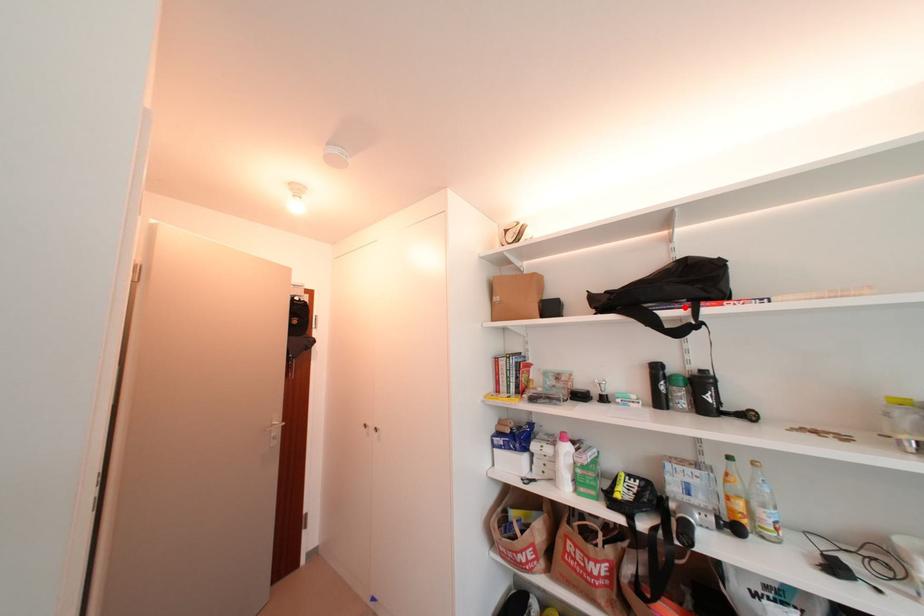
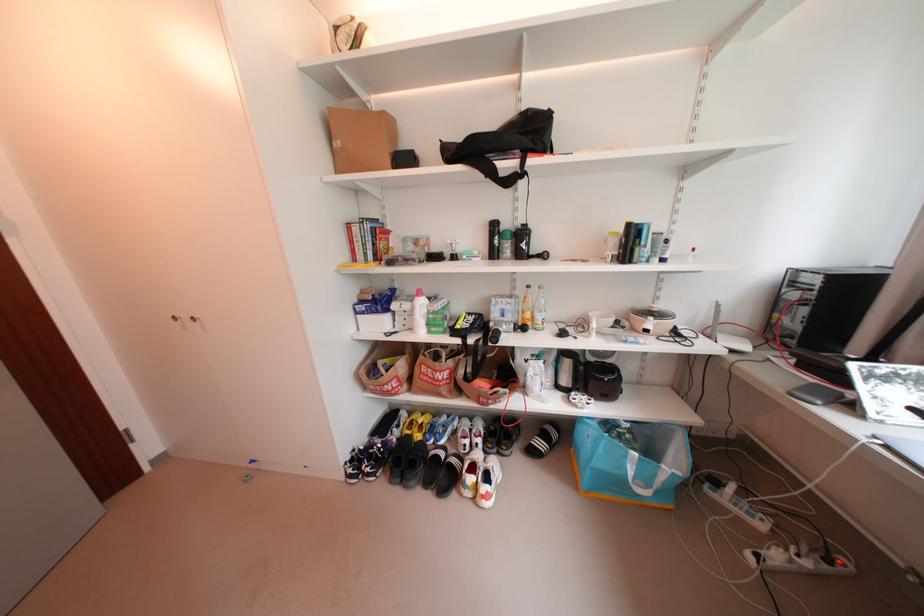
In the second image, find the point that corresponds to the highlighted location in the first image.

(518, 158)